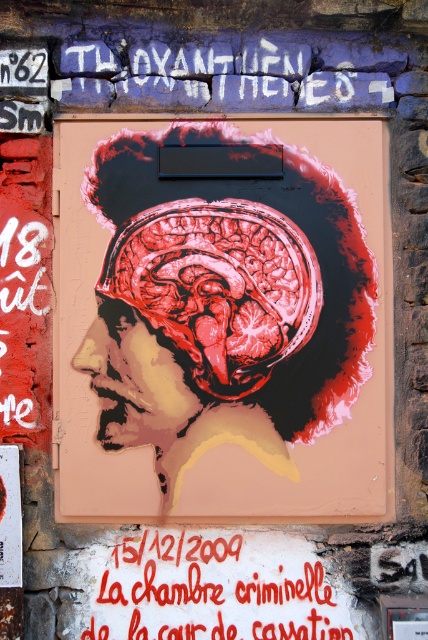
Is matte black anatomical brain at center below red painted text at center?

No, matte black anatomical brain at center is not below red painted text at center.

Which is more to the right, matte black anatomical brain at center or red painted text at center?

From the viewer's perspective, matte black anatomical brain at center appears more on the right side.

The height and width of the screenshot is (640, 428). Describe the element at coordinates (223, 320) in the screenshot. I see `matte black anatomical brain at center` at that location.

Locate an element on the screen. matte black anatomical brain at center is located at coordinates (223, 320).